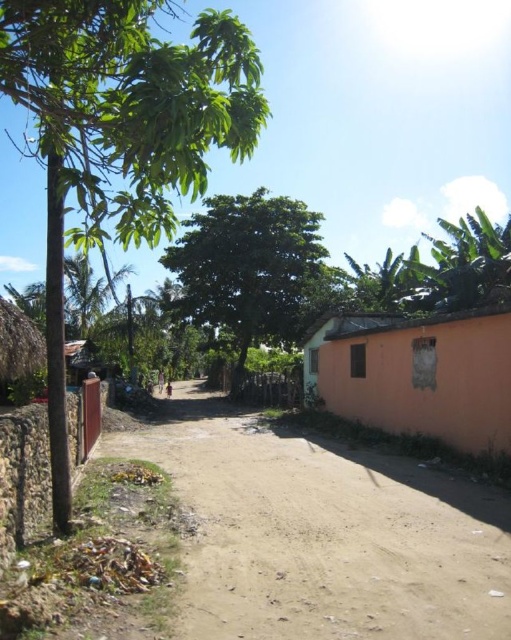
Question: Can you confirm if green leafy tree at center is positioned below green leafy tree at upper right?

Choices:
 (A) yes
 (B) no

Answer: (A)

Question: Does green leafy tree at left have a smaller size compared to green leafy tree at upper right?

Choices:
 (A) yes
 (B) no

Answer: (B)

Question: Which object is farther from the camera taking this photo?

Choices:
 (A) green leafy tree at center
 (B) brown sandy dirt track at center
 (C) orange matte wall at right

Answer: (A)

Question: Which object is positioned farthest from the brown sandy dirt track at center?

Choices:
 (A) green leafy tree at center
 (B) green leafy tree at left
 (C) orange matte wall at right

Answer: (A)

Question: Can you confirm if green leafy tree at left is bigger than green leafy tree at upper right?

Choices:
 (A) yes
 (B) no

Answer: (A)

Question: Among these points, which one is farthest from the camera?

Choices:
 (A) tap(284, 586)
 (B) tap(121, 221)
 (C) tap(190, 298)
 (D) tap(347, 339)

Answer: (C)